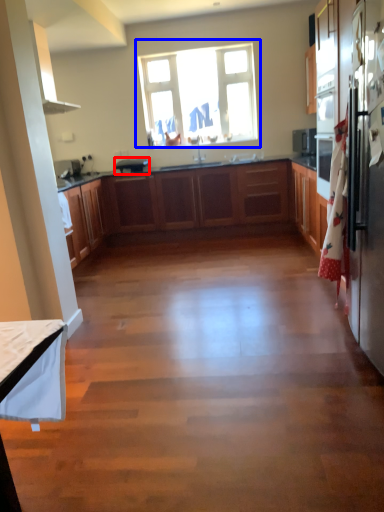
Question: Which object is further to the camera taking this photo, appliance (highlighted by a red box) or window (highlighted by a blue box)?

Choices:
 (A) appliance
 (B) window

Answer: (B)